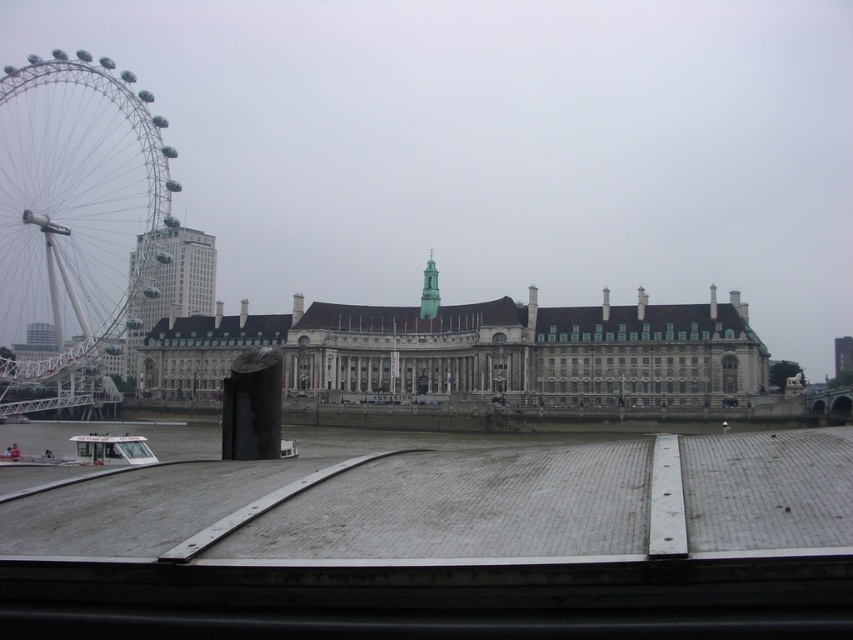
Question: Which of the following is the farthest from the observer?

Choices:
 (A) (427, 276)
 (B) (397, 353)

Answer: (A)

Question: Is matte gray sky at upper center further to the viewer compared to matte glass skyscraper at center-left?

Choices:
 (A) no
 (B) yes

Answer: (A)

Question: Which of the following is the farthest from the observer?

Choices:
 (A) stone building at center
 (B) green stone tower at center

Answer: (B)

Question: Does matte gray sky at upper center come in front of white metallic ferris wheel at left?

Choices:
 (A) no
 (B) yes

Answer: (B)

Question: Among these points, which one is farthest from the camera?

Choices:
 (A) (136, 300)
 (B) (334, 106)
 (C) (433, 317)

Answer: (B)

Question: Is stone building at center to the right of matte glass skyscraper at center-left from the viewer's perspective?

Choices:
 (A) yes
 (B) no

Answer: (A)